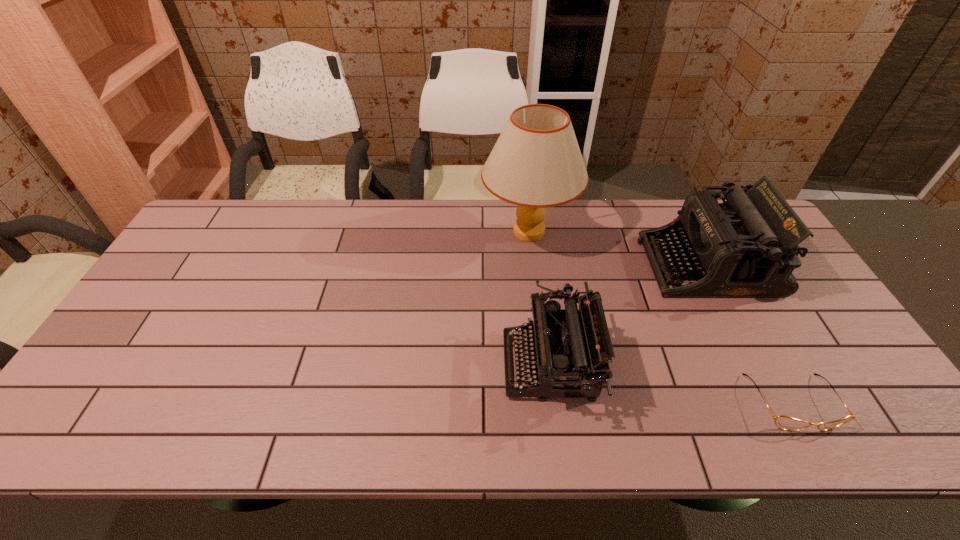
You are a GUI agent. You are given a task and a screenshot of the screen. Output one action in this format:
    pyautogui.click(x=<x>, y=<y>)
    Task: Click on the vacant space in between the shortest object and the right typewriter
    
    Given the screenshot: What is the action you would take?
    pyautogui.click(x=750, y=334)

In order to click on vacant area that lies between the spectacles and the left typewriter in this screenshot , I will do `click(671, 384)`.

At what (x,y) coordinates should I click in order to perform the action: click on free spot between the third shortest object and the nearer typewriter. Please return your answer as a coordinate pair (x, y). Looking at the image, I should click on (629, 315).

You are a GUI agent. You are given a task and a screenshot of the screen. Output one action in this format:
    pyautogui.click(x=<x>, y=<y>)
    Task: Click on the object that is the third closest to the left typewriter
    
    Given the screenshot: What is the action you would take?
    pyautogui.click(x=783, y=422)

This screenshot has height=540, width=960. In order to click on object that is the second nearest to the tallest object in this screenshot , I will do `click(570, 349)`.